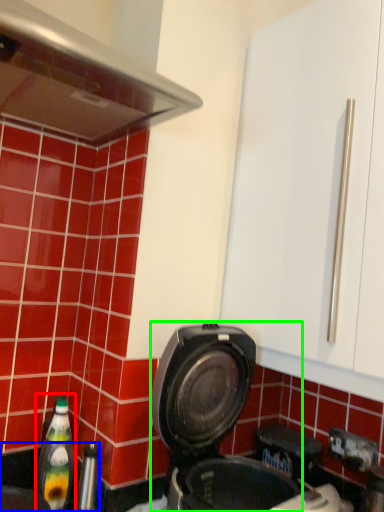
Question: Which is nearer to the bottle (highlighted by a red box)? sink (highlighted by a blue box) or kitchen appliance (highlighted by a green box).

Choices:
 (A) sink
 (B) kitchen appliance

Answer: (A)